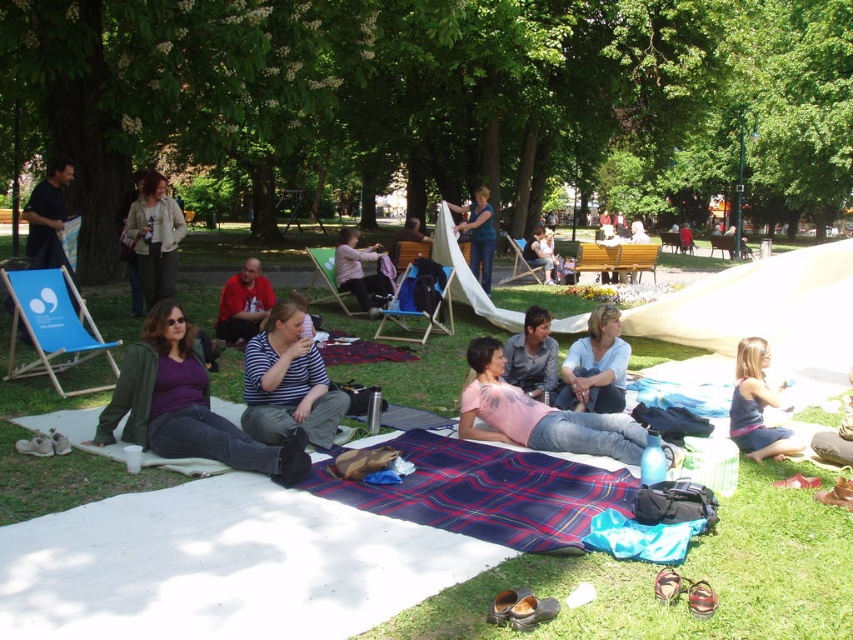
Who is positioned more to the right, matte purple shirt at center or matte blue tank top at lower right?

Positioned to the right is matte blue tank top at lower right.

The image size is (853, 640). I want to click on matte purple shirt at center, so click(x=184, y=404).

Describe the element at coordinates (757, 406) in the screenshot. Image resolution: width=853 pixels, height=640 pixels. I see `matte blue tank top at lower right` at that location.

Is matte blue tank top at lower right above denim shirt at center?

No, matte blue tank top at lower right is not above denim shirt at center.

Is point (764, 424) positioned before point (531, 374)?

Yes, point (764, 424) is in front of point (531, 374).

You are a GUI agent. You are given a task and a screenshot of the screen. Output one action in this format:
    pyautogui.click(x=<x>, y=<y>)
    Task: Click on the matte blue tank top at lower right
    
    Given the screenshot: What is the action you would take?
    pyautogui.click(x=757, y=406)

Between point (811, 538) and point (540, 401), which one is positioned behind?

Positioned behind is point (540, 401).

Is green grass at center bigger than denim shirt at center?

Yes, green grass at center is bigger than denim shirt at center.

At what (x,y) coordinates should I click in order to perform the action: click on green grass at center. Please return your answer as a coordinate pair (x, y). Looking at the image, I should click on (219, 566).

Image resolution: width=853 pixels, height=640 pixels. What are the coordinates of `green grass at center` in the screenshot? It's located at (219, 566).